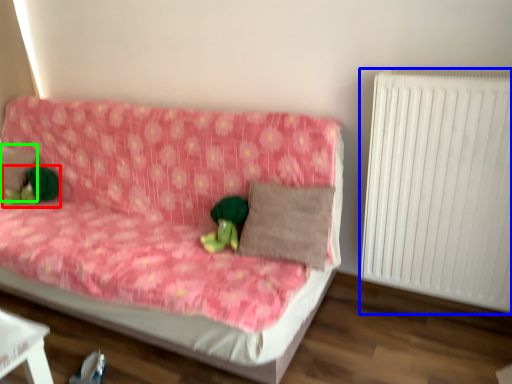
Question: Based on their relative distances, which object is nearer to toy (highlighted by a red box)? Choose from radiator (highlighted by a blue box) and pillow (highlighted by a green box).

Choices:
 (A) radiator
 (B) pillow

Answer: (B)